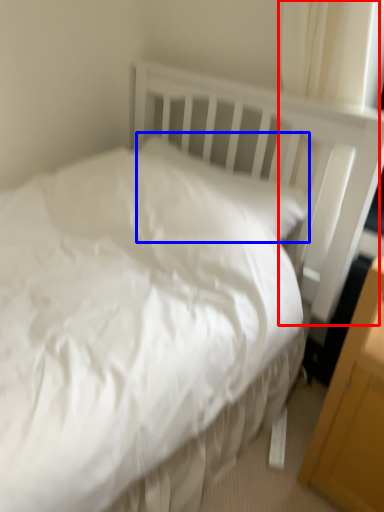
Question: Which point is closer to the camera, curtain (highlighted by a red box) or pillow (highlighted by a blue box)?

Choices:
 (A) curtain
 (B) pillow

Answer: (A)